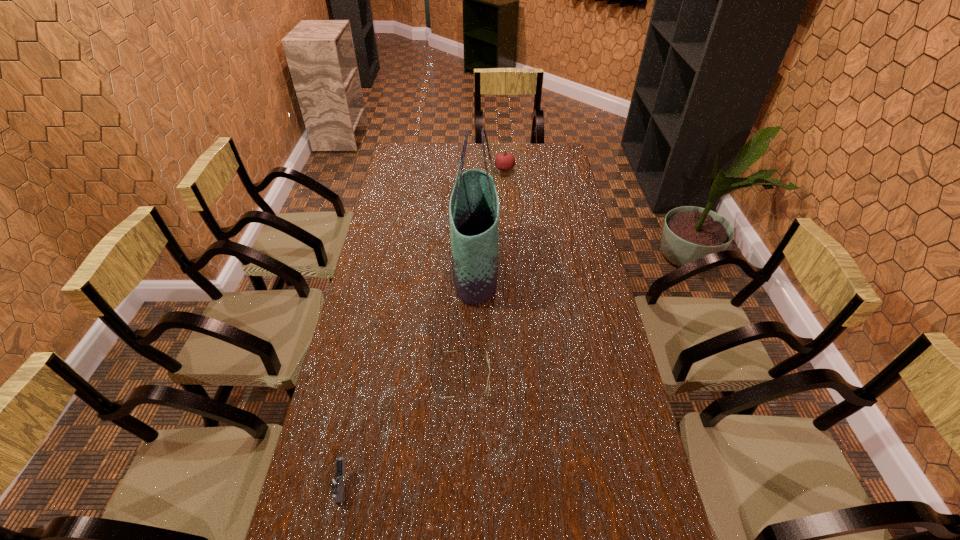
Identify the location of vacant space that is in between the nearest object and the tallest object. This screenshot has width=960, height=540. (409, 376).

In order to click on empty space that is in between the nearest object and the farthest object in this screenshot , I will do `click(423, 327)`.

Image resolution: width=960 pixels, height=540 pixels. I want to click on empty location between the third nearest object and the leftmost object, so click(409, 376).

Identify which object is located as the second nearest to the shortest object. Please provide its 2D coordinates. Your answer should be formatted as a tuple, i.e. [(x, y)], where the tuple contains the x and y coordinates of a point satisfying the conditions above.

[(336, 483)]

Where is `the closest object to the farthest object`? The image size is (960, 540). the closest object to the farthest object is located at coordinates (474, 212).

Locate an element on the screen. The image size is (960, 540). free region that satisfies the following two spatial constraints: 1. on the front-facing side of the shortest object; 2. on the front side of the igniter is located at coordinates (462, 484).

Image resolution: width=960 pixels, height=540 pixels. Identify the location of free space that satisfies the following two spatial constraints: 1. on the front-facing side of the third farthest object; 2. on the front side of the nearest object. tap(462, 484).

Where is `vacant region that satisfies the following two spatial constraints: 1. on the back side of the tallest object; 2. on the right side of the igniter`? The width and height of the screenshot is (960, 540). vacant region that satisfies the following two spatial constraints: 1. on the back side of the tallest object; 2. on the right side of the igniter is located at coordinates (389, 268).